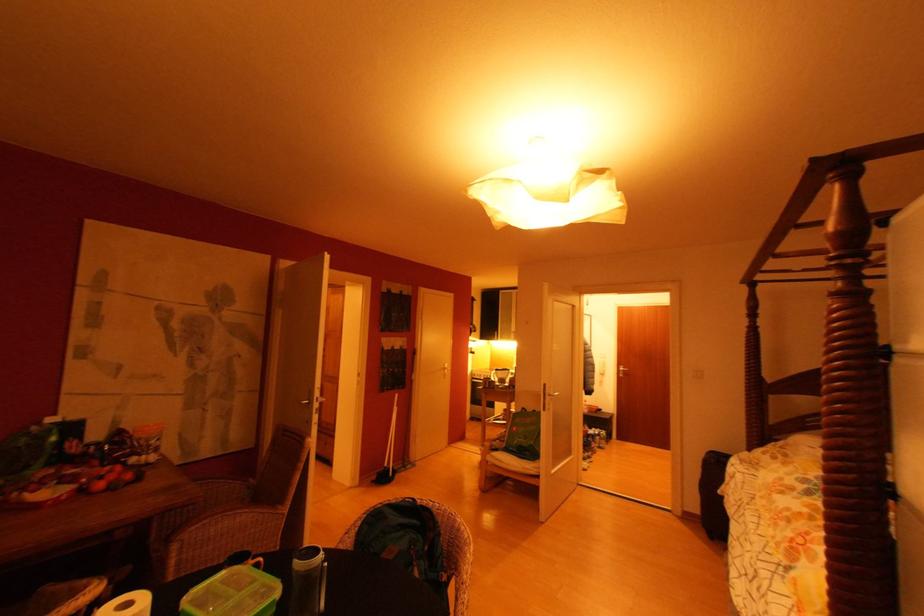
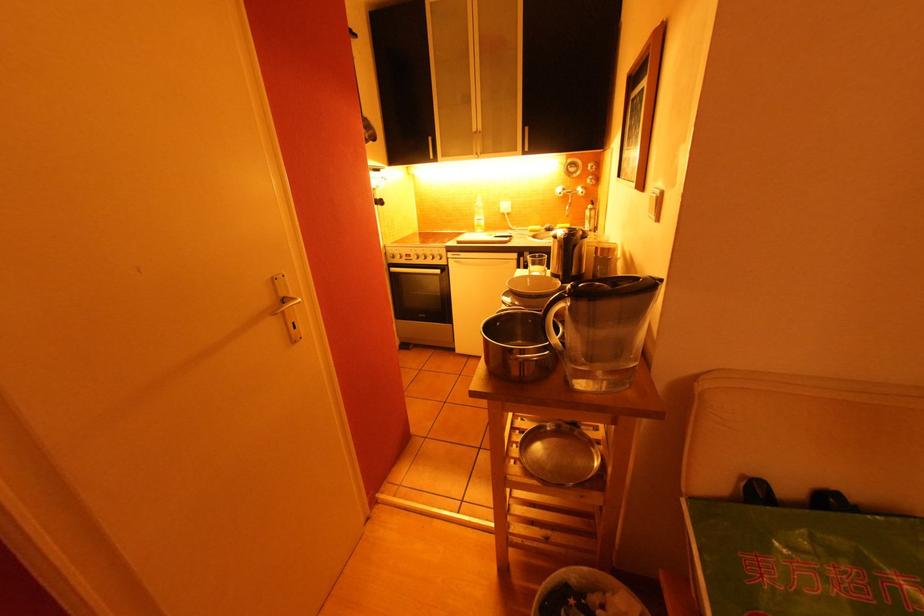
Find the pixel in the second image that matches the point at 501,334 in the first image.

(434, 140)